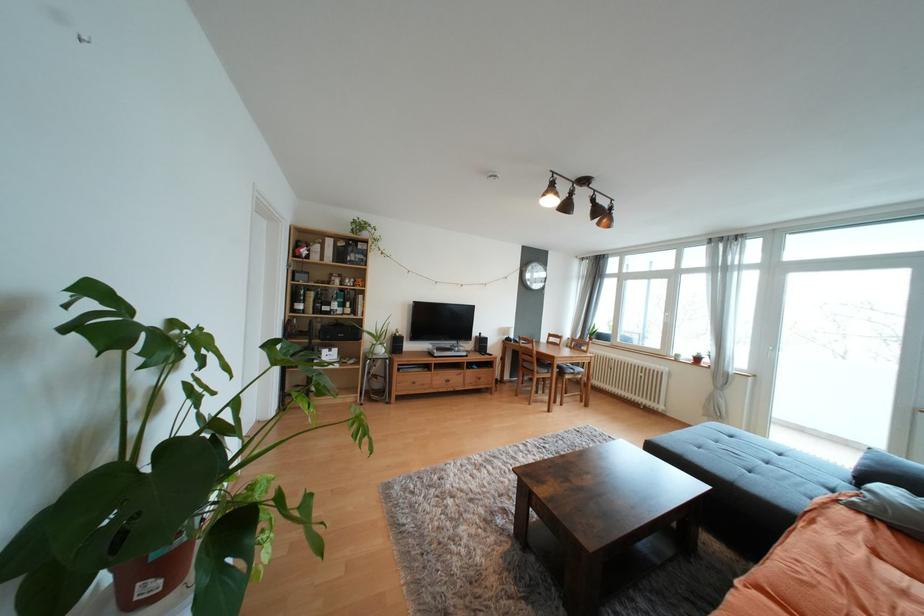
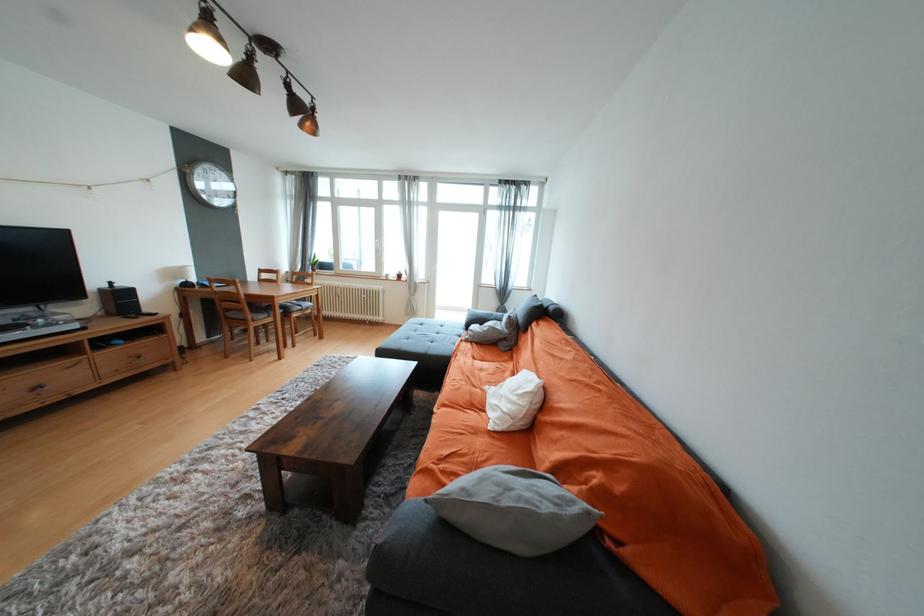
Based on the continuous images, in which direction is the camera rotating?

The camera's rotation is toward right-down.